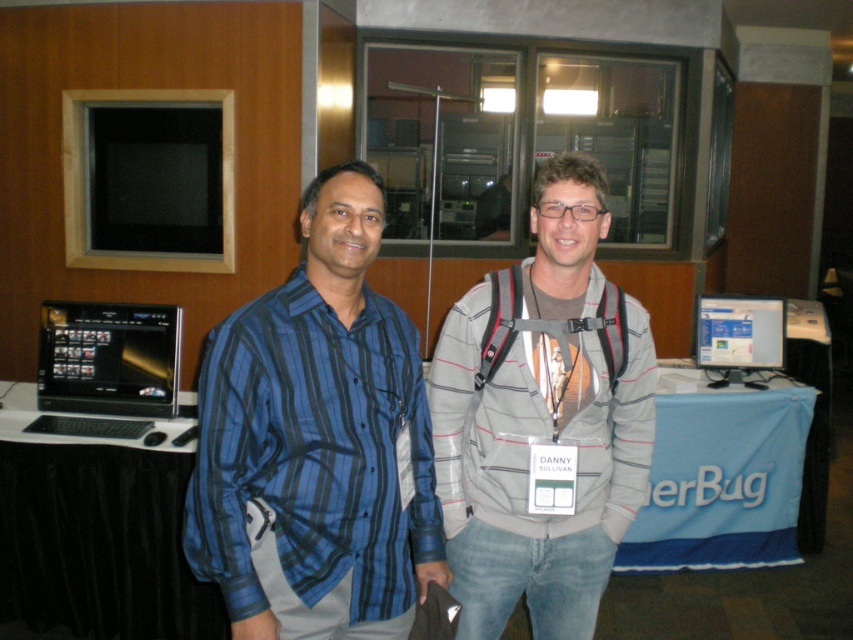
Does blue striped shirt at center appear over matte black monitor at center?

No.

Find the location of a particular element. This screenshot has width=853, height=640. blue striped shirt at center is located at coordinates (317, 442).

Does point (360, 282) lie in front of point (697, 308)?

Yes, it is in front of point (697, 308).

At what (x,y) coordinates should I click in order to perform the action: click on blue striped shirt at center. Please return your answer as a coordinate pair (x, y). This screenshot has height=640, width=853. Looking at the image, I should click on (317, 442).

Is point (454, 307) closer to viewer compared to point (56, 371)?

Yes, it is.

Can you confirm if gray striped hoodie at center is smaller than black glossy laptop at left?

Incorrect, gray striped hoodie at center is not smaller in size than black glossy laptop at left.

Does point (491, 516) come closer to viewer compared to point (70, 356)?

Yes, point (491, 516) is in front of point (70, 356).

Where is `gray striped hoodie at center`? Image resolution: width=853 pixels, height=640 pixels. gray striped hoodie at center is located at coordinates (543, 420).

Is gray striped hoodie at center further to the viewer compared to black fabric table at center?

No, gray striped hoodie at center is in front of black fabric table at center.

Is gray striped hoodie at center shorter than black fabric table at center?

In fact, gray striped hoodie at center may be taller than black fabric table at center.

Which is behind, point (497, 294) or point (105, 534)?

The point (105, 534) is behind.

Where is `gray striped hoodie at center`? The width and height of the screenshot is (853, 640). gray striped hoodie at center is located at coordinates (543, 420).